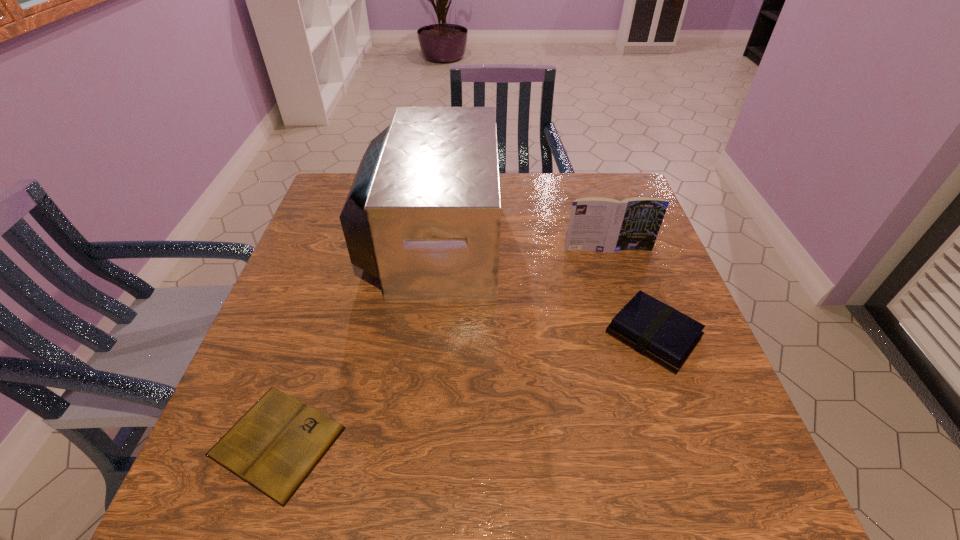
The height and width of the screenshot is (540, 960). In order to click on the tallest object in this screenshot , I will do `click(423, 215)`.

In order to click on the tallest book in this screenshot , I will do `click(606, 225)`.

The image size is (960, 540). I want to click on the farthest book, so click(x=606, y=225).

What are the coordinates of `the second shortest book` in the screenshot? It's located at (656, 330).

Find the location of a particular element. Image resolution: width=960 pixels, height=540 pixels. the third tallest object is located at coordinates (656, 330).

What are the coordinates of `the shortest book` in the screenshot? It's located at (274, 447).

What are the coordinates of `the shortest object` in the screenshot? It's located at (274, 447).

Locate an element on the screen. free region located on the front-facing side of the tallest object is located at coordinates (514, 238).

In order to click on vacant space located 0.380m on the front cover of the third shortest object in this screenshot , I will do `click(648, 377)`.

Where is `free space located on the left of the second farthest book`? free space located on the left of the second farthest book is located at coordinates point(509,336).